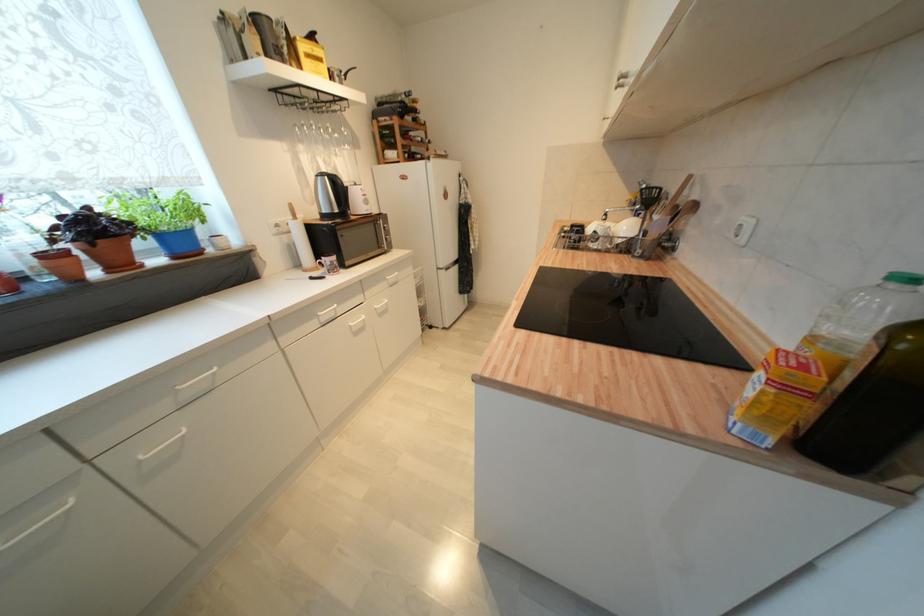
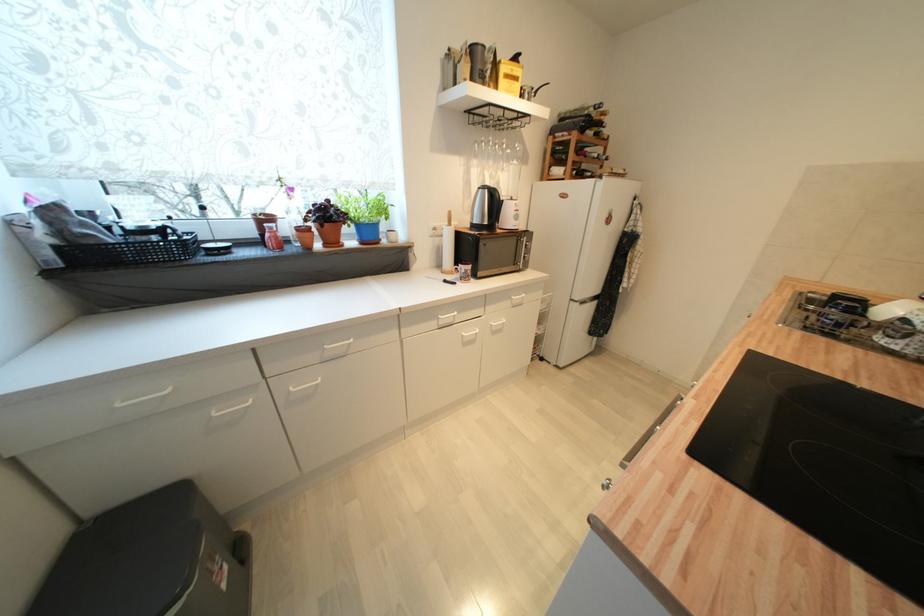
The point at (326, 177) is marked in the first image. Where is the corresponding point in the second image?

(489, 188)